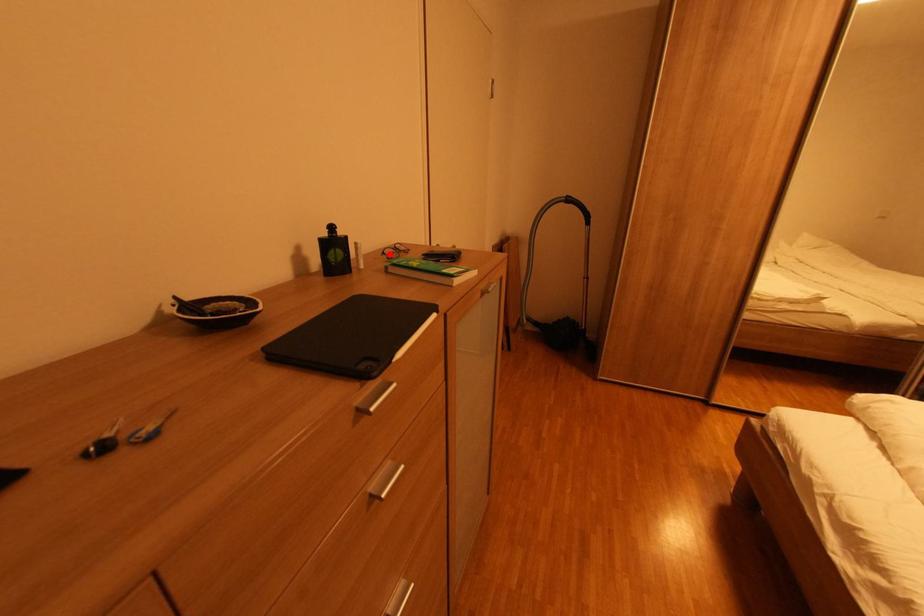
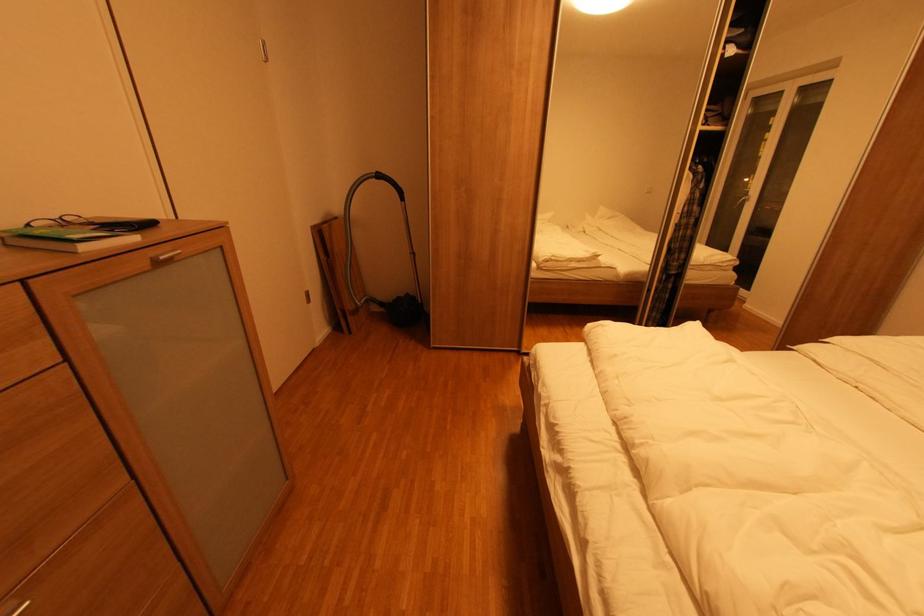
Find the pixel in the second image that matches the highlighted location in the first image.

(35, 225)